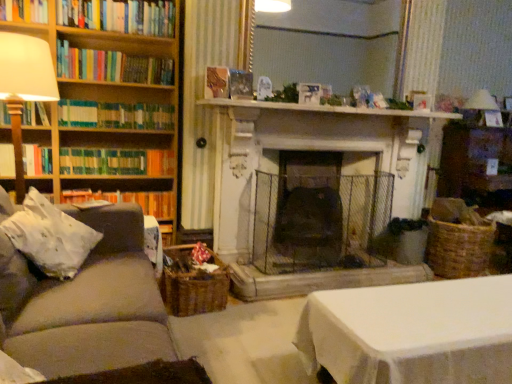
Question: From their relative heights in the image, would you say white fabric pillow at left is taller or shorter than green matte bookshelf at left, arranged as the 3th book when ordered from the bottom?

Choices:
 (A) tall
 (B) short

Answer: (A)

Question: Based on their positions, is white fabric pillow at left located to the left or right of green matte bookshelf at left, which is counted as the sixth book, starting from the top?

Choices:
 (A) right
 (B) left

Answer: (A)

Question: Based on their relative distances, which object is nearer to the white marble fireplace at center?

Choices:
 (A) gray fabric couch at left
 (B) wooden bookshelf at left
 (C) matte white lampshade at left, arranged as the second table lamp when viewed from the right
 (D) hardcover book at left, the second book in the bottom-to-top sequence
 (E) woven brown basket at lower center

Answer: (B)

Question: Estimate the real-world distances between objects in this image. Which object is farther from the hardcover book at left, acting as the first book starting from the bottom?

Choices:
 (A) white fabric pillow at left
 (B) hardcover book at upper left, the second book in the top-to-bottom sequence
 (C) green matte bookshelf at left, which is counted as the sixth book, starting from the top
 (D) hardcover books at upper left, which is the eighth book in bottom-to-top order
 (E) white marble fireplace at center

Answer: (B)